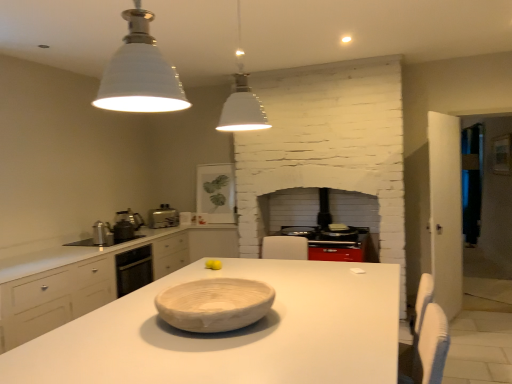
Question: From the image's perspective, is white matte pendant light at upper center, the 1th light fixture when ordered from back to front, above or below natural wood bowl at center?

Choices:
 (A) above
 (B) below

Answer: (A)

Question: Looking at the image, does white matte pendant light at upper center, the 1th light fixture when ordered from back to front, seem bigger or smaller compared to natural wood bowl at center?

Choices:
 (A) big
 (B) small

Answer: (A)

Question: Which object is positioned closest to the yellow matte tennis ball at center?

Choices:
 (A) transparent glass door at right
 (B) black glass stove at center, acting as the 3th appliance starting from the front
 (C) satin silver kettle at left, the 1th appliance positioned from the left
 (D) white matte pendant light at upper center, arranged as the second light fixture when viewed from the front
 (E) metallic silver toaster at center-left

Answer: (C)

Question: Which of these objects is positioned closest to the white ceramic light fixture at upper center, which is counted as the second light fixture, starting from the back?

Choices:
 (A) white matte countertop at center
 (B) matte white framed picture at upper center, which is the 1th appliance from back to front
 (C) natural wood bowl at center
 (D) metallic silver kettle at left, the 2th appliance when ordered from left to right
 (E) yellow matte tennis ball at center

Answer: (C)